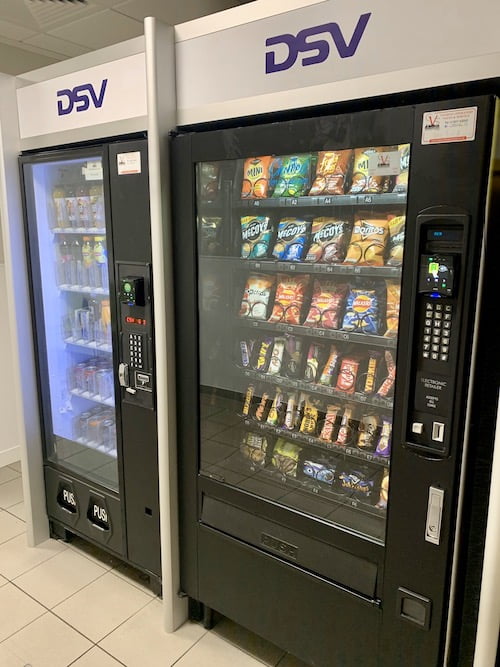
This screenshot has width=500, height=667. Find the location of `vending machine`. vending machine is located at coordinates (76, 327), (327, 441).